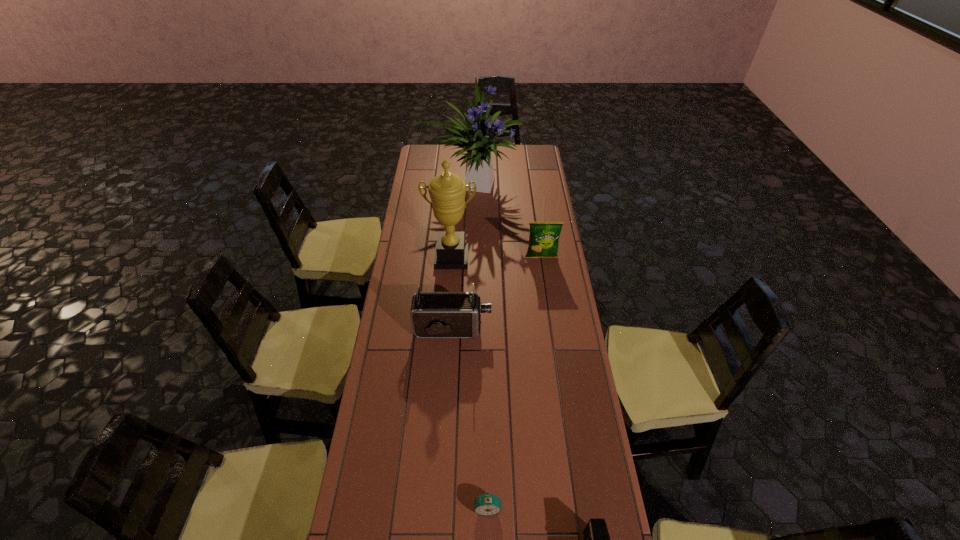
I want to click on the farthest object, so click(476, 138).

Locate an element on the screen. The height and width of the screenshot is (540, 960). trophy cup is located at coordinates (447, 191).

Where is `the left camcorder`? Image resolution: width=960 pixels, height=540 pixels. the left camcorder is located at coordinates (433, 314).

Find the location of a particular element. Image resolution: width=960 pixels, height=540 pixels. the taller camcorder is located at coordinates (433, 314).

Locate an element on the screen. crisp (potato chip) is located at coordinates (543, 241).

The height and width of the screenshot is (540, 960). What are the coordinates of `the second nearest object` in the screenshot? It's located at (487, 504).

Find the location of a particular element. This screenshot has width=960, height=540. alarm clock is located at coordinates (487, 504).

This screenshot has width=960, height=540. Find the location of `free region located on the right of the farthest object`. free region located on the right of the farthest object is located at coordinates (549, 184).

Image resolution: width=960 pixels, height=540 pixels. Identify the location of free space located at the front of the trophy cup with handles. (450, 284).

Find the location of a particular element. This screenshot has width=960, height=540. vacant space situated at the lens of the left camcorder is located at coordinates (574, 329).